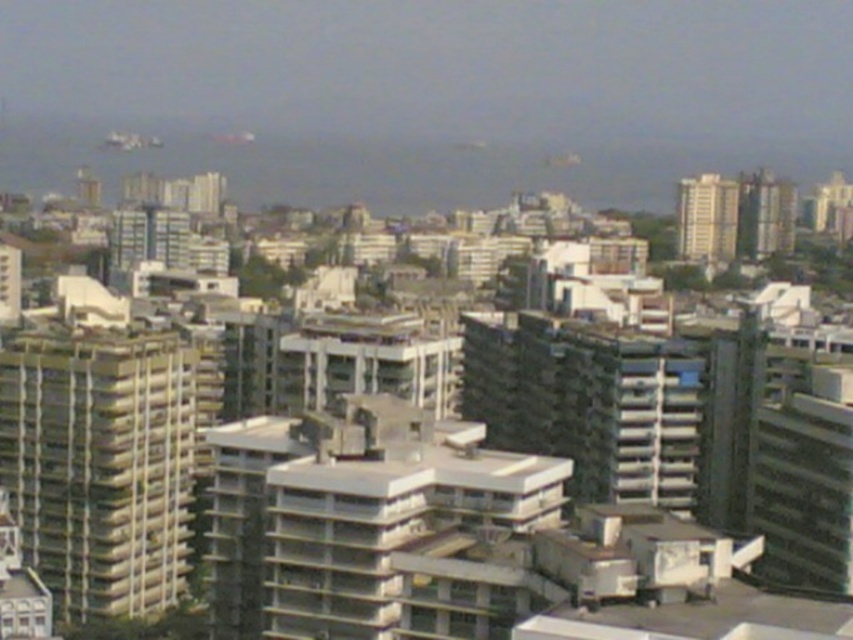
You are an urban planner assessing the space between two buildings in the image. The beige concrete building at center and the smooth beige building at upper right. Which building has a wider base? Please consider their widths as seen from your perspective.

The smooth beige building at upper right has a greater width compared to the beige concrete building at center, so it has a wider base.

You are an urban planner evaluating building heights in this city. Which of the two buildings, the beige concrete building at left or the smooth beige building at upper right, has a greater height?

The beige concrete building at left is taller than the smooth beige building at upper right according to the description provided.